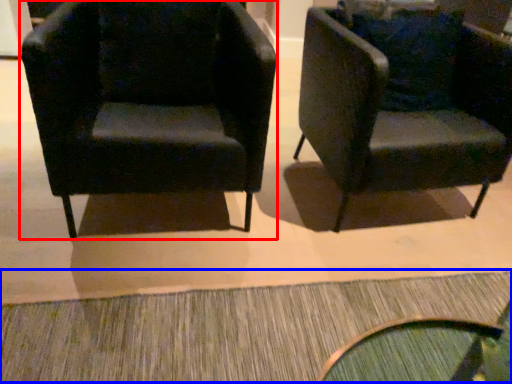
Question: Which object appears closest to the camera in this image, chair (highlighted by a red box) or doormat (highlighted by a blue box)?

Choices:
 (A) chair
 (B) doormat

Answer: (B)